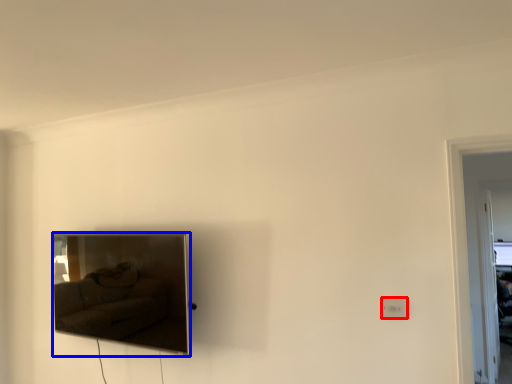
Question: Which object appears farthest to the camera in this image, electric outlet (highlighted by a red box) or picture frame (highlighted by a blue box)?

Choices:
 (A) electric outlet
 (B) picture frame

Answer: (B)